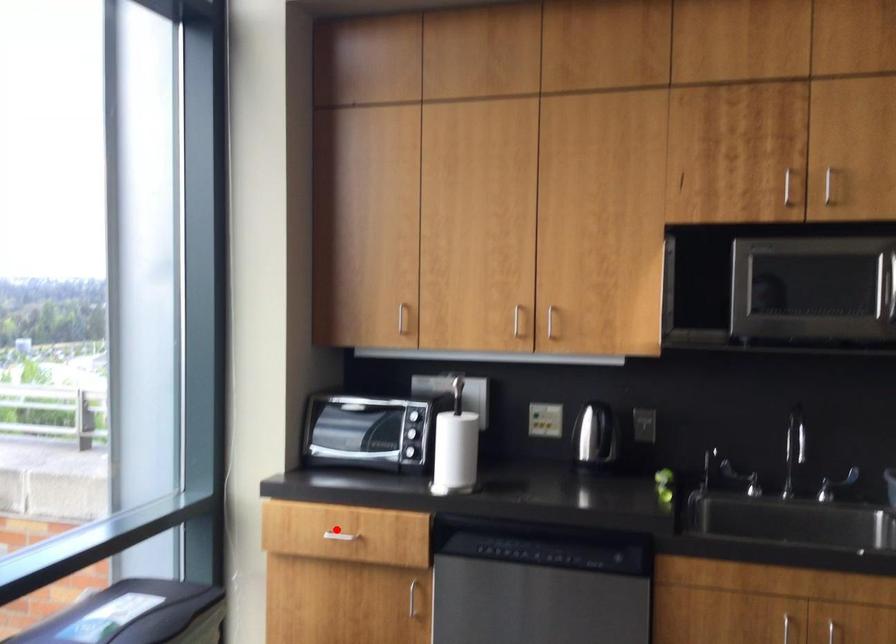
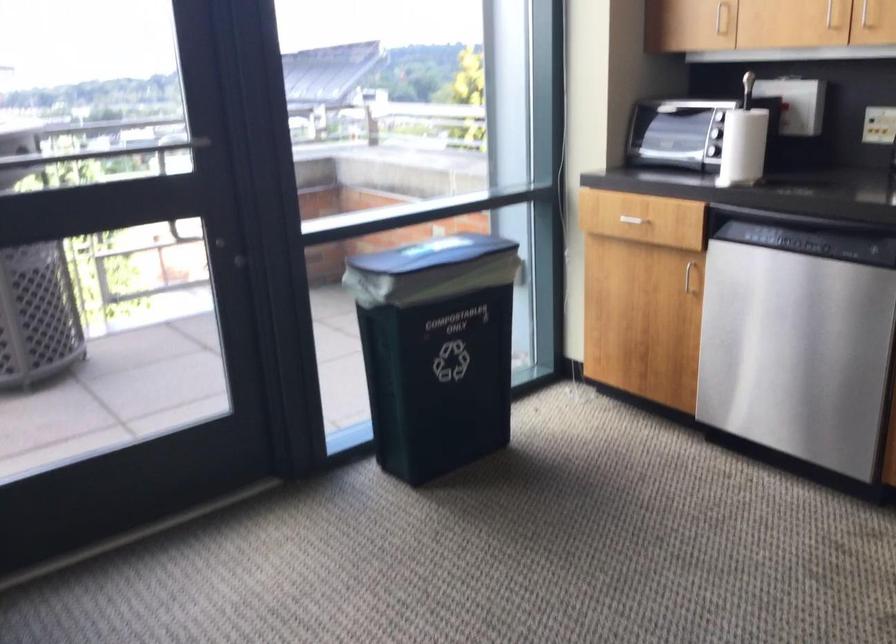
Question: I am providing you with two images of the same scene from different viewpoints. Image1 has a red point marked. In image2, the corresponding 3D location appears at what relative position? Reply with the corresponding letter.

Choices:
 (A) Closer
 (B) Farther

Answer: (B)